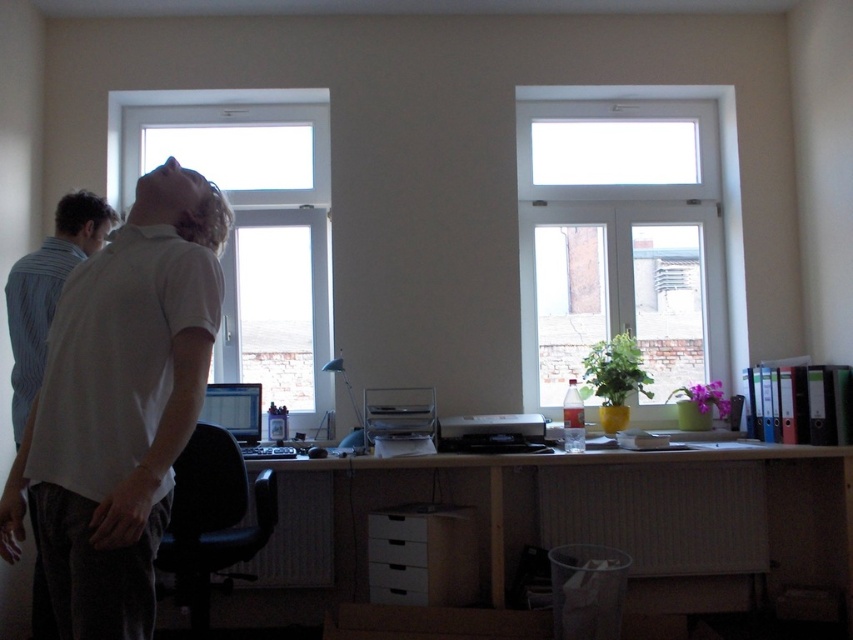
You are standing in the office and want to reach both points on the desk. Which point, point 1 at (671, 186) or point 2 at (798, 456), will you reach first as you approach the desk?

You will reach point 2 at (798, 456) first because point 1 at (671, 186) is further away from you, being closer to the camera in the image.